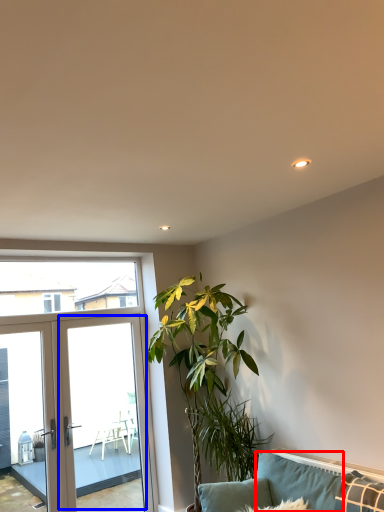
Question: Which point is further to the camera, pillow (highlighted by a red box) or screen door (highlighted by a blue box)?

Choices:
 (A) pillow
 (B) screen door

Answer: (B)